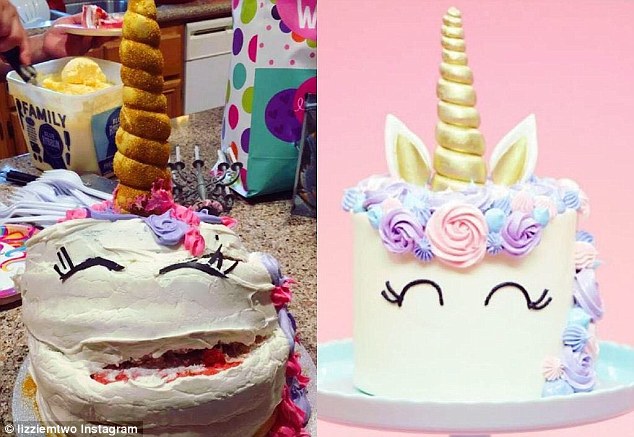
Where is `plate`? This screenshot has height=437, width=634. plate is located at coordinates (94, 33), (339, 391), (21, 409).